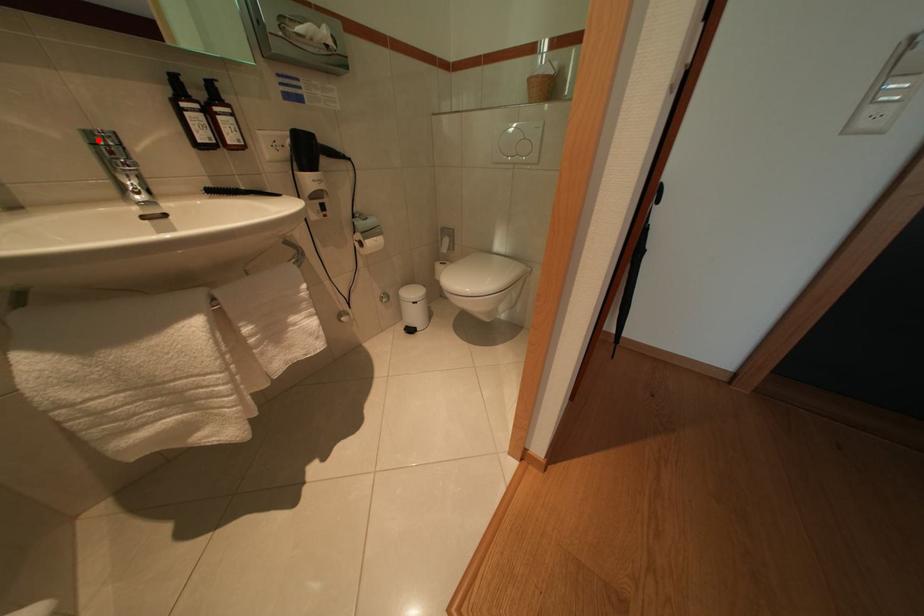
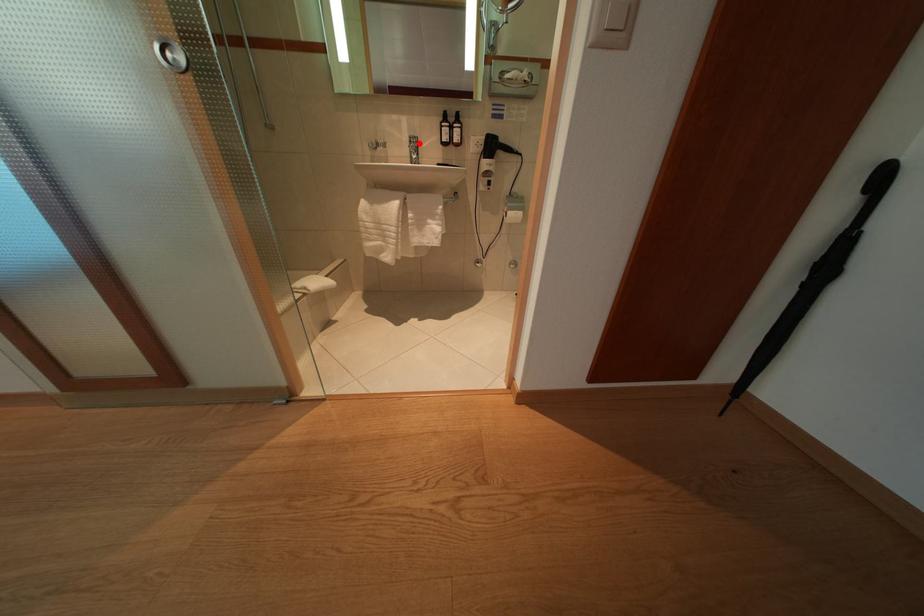
I am providing you with two images of the same scene from different viewpoints. A red point is marked on the first image and another point is marked on the second image. Do the highlighted points in image1 and image2 indicate the same real-world spot?

Yes